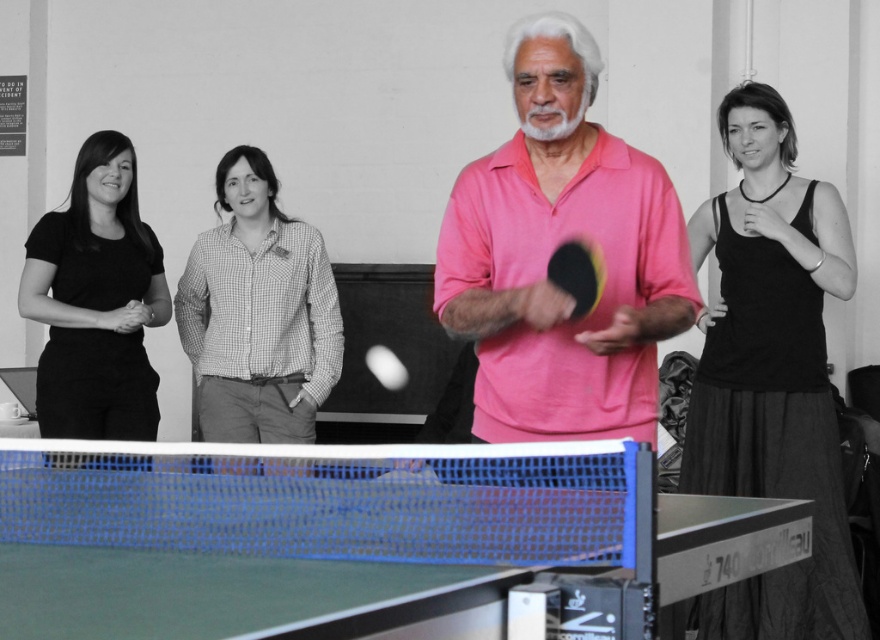
You are a photographer standing behind the ping pong table. You want to take a photo of the black cotton tank top at right and the rubber paddle at center so that both are visible in the frame. Given their height difference, which object should you adjust the camera angle to focus on to ensure both are in the frame?

The black cotton tank top at right is much taller than the rubber paddle at center. To ensure both are visible in the frame, you should lower the camera angle slightly to account for the height difference between the two objects.

You are a photographer trying to capture a wide shot of the ping pong table and the players. Given that the green rubber table tennis table at center is smaller than the black cotton tank top at right, will you need to adjust your camera angle to include both the table and the tank top in the frame?

The green rubber table tennis table at center occupies less space than the black cotton tank top at right, so you will need to adjust your camera angle to ensure both the table and the tank top are fully visible in the frame.